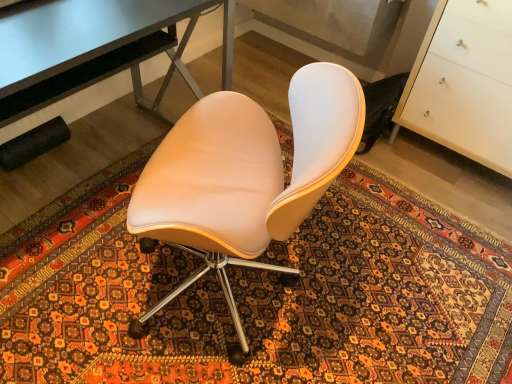
Question: Considering the relative sizes of matte beige chair at center and metallic gray desk at upper left in the image provided, is matte beige chair at center wider than metallic gray desk at upper left?

Choices:
 (A) yes
 (B) no

Answer: (A)

Question: From the image's perspective, is matte beige chair at center located above metallic gray desk at upper left?

Choices:
 (A) yes
 (B) no

Answer: (B)

Question: Is there a large distance between matte beige chair at center and metallic gray desk at upper left?

Choices:
 (A) no
 (B) yes

Answer: (A)

Question: Is matte beige chair at center in front of metallic gray desk at upper left?

Choices:
 (A) no
 (B) yes

Answer: (B)

Question: Is matte beige chair at center placed right next to metallic gray desk at upper left?

Choices:
 (A) yes
 (B) no

Answer: (B)

Question: In the image, is metallic gray desk at upper left on the left side or the right side of patterned carpet at center?

Choices:
 (A) left
 (B) right

Answer: (A)

Question: Considering the positions of metallic gray desk at upper left and patterned carpet at center in the image, is metallic gray desk at upper left wider or thinner than patterned carpet at center?

Choices:
 (A) wide
 (B) thin

Answer: (B)

Question: In terms of size, does metallic gray desk at upper left appear bigger or smaller than patterned carpet at center?

Choices:
 (A) small
 (B) big

Answer: (A)

Question: Is point (69, 48) positioned closer to the camera than point (83, 327)?

Choices:
 (A) farther
 (B) closer

Answer: (B)

Question: Is metallic gray desk at upper left wider or thinner than white glossy cabinet at right?

Choices:
 (A) wide
 (B) thin

Answer: (B)

Question: Does point (71, 61) appear closer or farther from the camera than point (435, 139)?

Choices:
 (A) closer
 (B) farther

Answer: (A)

Question: Do you think metallic gray desk at upper left is within white glossy cabinet at right, or outside of it?

Choices:
 (A) outside
 (B) inside

Answer: (A)

Question: In the image, is metallic gray desk at upper left on the left side or the right side of white glossy cabinet at right?

Choices:
 (A) right
 (B) left

Answer: (B)

Question: Is point (428, 99) closer or farther from the camera than point (189, 301)?

Choices:
 (A) farther
 (B) closer

Answer: (A)

Question: From the image's perspective, is white glossy cabinet at right positioned above or below patterned carpet at center?

Choices:
 (A) above
 (B) below

Answer: (A)